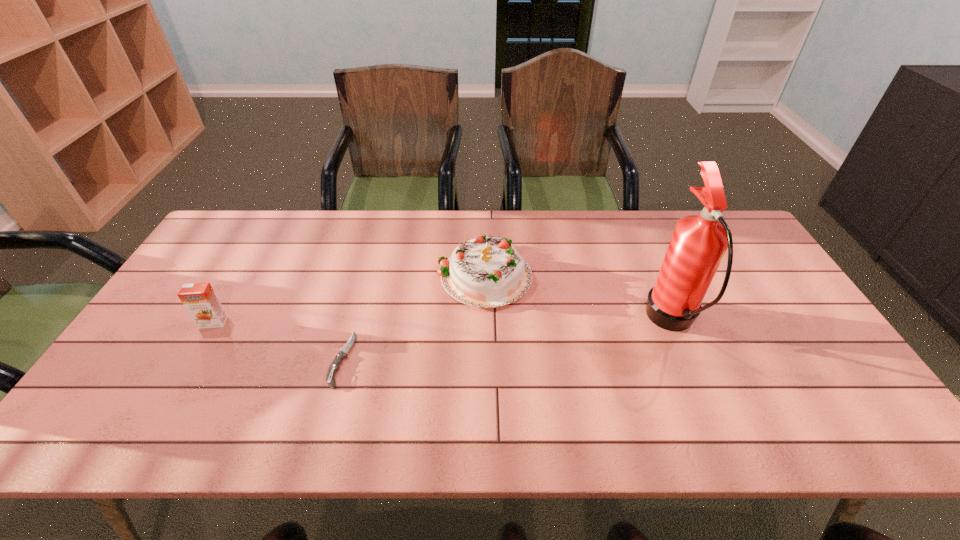
You are a GUI agent. You are given a task and a screenshot of the screen. Output one action in this format:
    pyautogui.click(x=<x>, y=<y>)
    Task: Click on the object that is the second closest to the shortest object
    
    Given the screenshot: What is the action you would take?
    pyautogui.click(x=199, y=299)